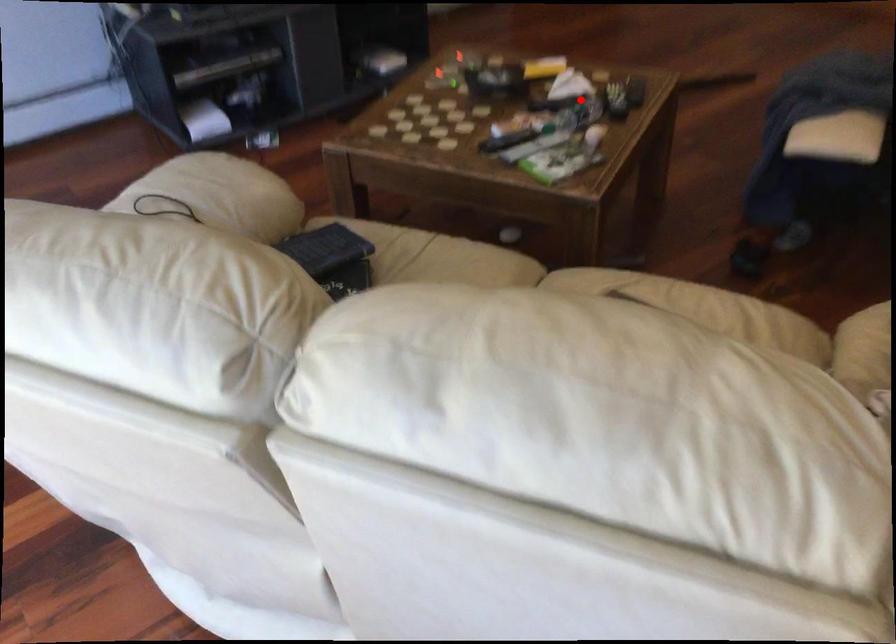
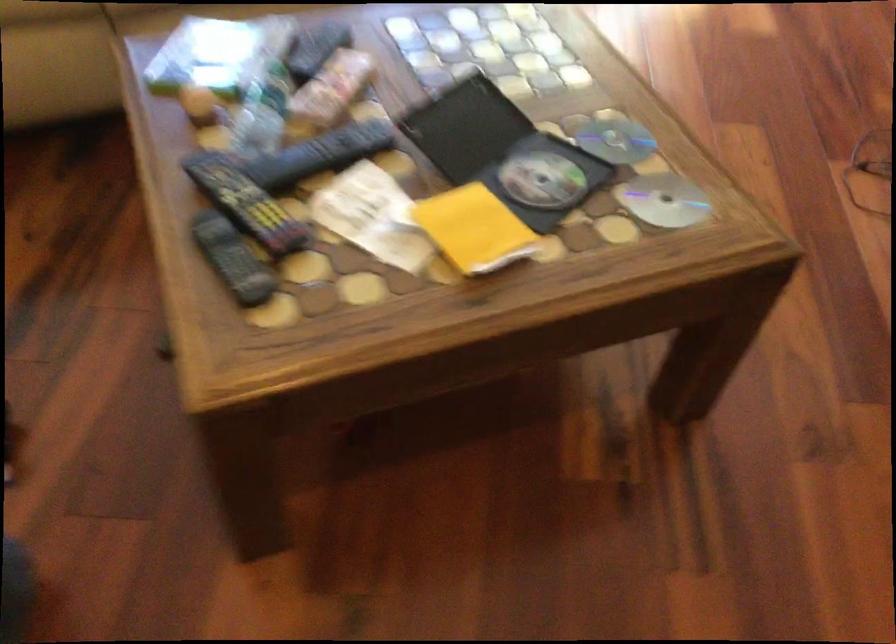
Question: I am providing you with two images of the same scene from different viewpoints. Given a red point in image1, look at the same physical point in image2. Is it:

Choices:
 (A) Closer to the viewpoint
 (B) Farther from the viewpoint

Answer: (A)